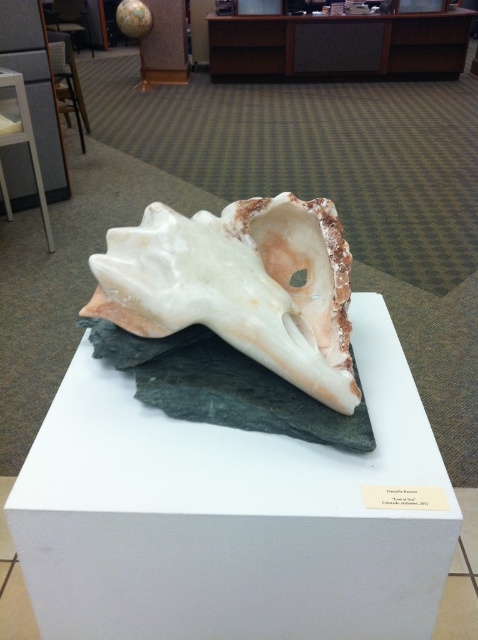
You are a GUI agent. You are given a task and a screenshot of the screen. Output one action in this format:
    pyautogui.click(x=<x>, y=<y>)
    Task: Click on the white matte stone at center
    This screenshot has height=640, width=478.
    Given the screenshot: What is the action you would take?
    pyautogui.click(x=232, y=515)

Can you confirm if white matte stone at center is wider than white matte shell at center?

Indeed, white matte stone at center has a greater width compared to white matte shell at center.

Find the location of a particular element. white matte stone at center is located at coordinates (232, 515).